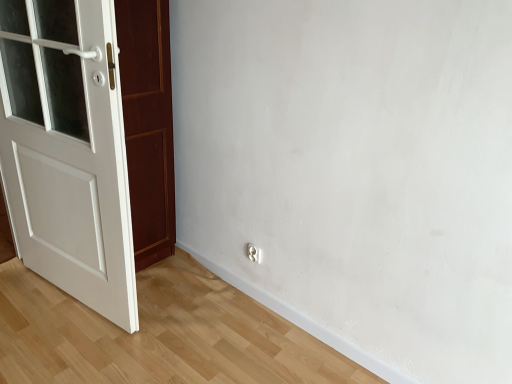
Where is `vacant area situated below white painted wood door at left (from a real-world perspective)`? vacant area situated below white painted wood door at left (from a real-world perspective) is located at coordinates (72, 304).